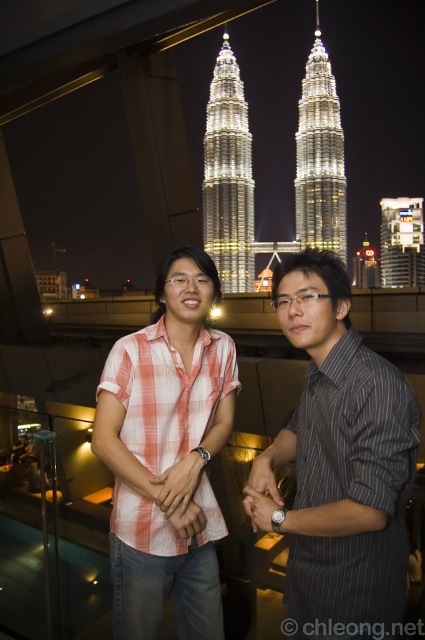
Is point (413, 404) closer to camera compared to point (345, 260)?

That is True.

Can you confirm if gray striped shirt at center is smaller than white illuminated building at center?

No, gray striped shirt at center is not smaller than white illuminated building at center.

Who is more distant from viewer, (x=376, y=369) or (x=306, y=97)?

The point (x=306, y=97) is behind.

Find the location of a particular element. The image size is (425, 640). gray striped shirt at center is located at coordinates (339, 461).

Does gray striped shirt at center have a greater height compared to plaid shirt at center?

In fact, gray striped shirt at center may be shorter than plaid shirt at center.

Is gray striped shirt at center thinner than plaid shirt at center?

Incorrect, gray striped shirt at center's width is not less than plaid shirt at center's.

The width and height of the screenshot is (425, 640). What do you see at coordinates (339, 461) in the screenshot?
I see `gray striped shirt at center` at bounding box center [339, 461].

The image size is (425, 640). I want to click on gray striped shirt at center, so click(339, 461).

Does point (339, 337) come in front of point (424, 252)?

Yes.

Identify the location of gray striped shirt at center. The image size is (425, 640). (339, 461).